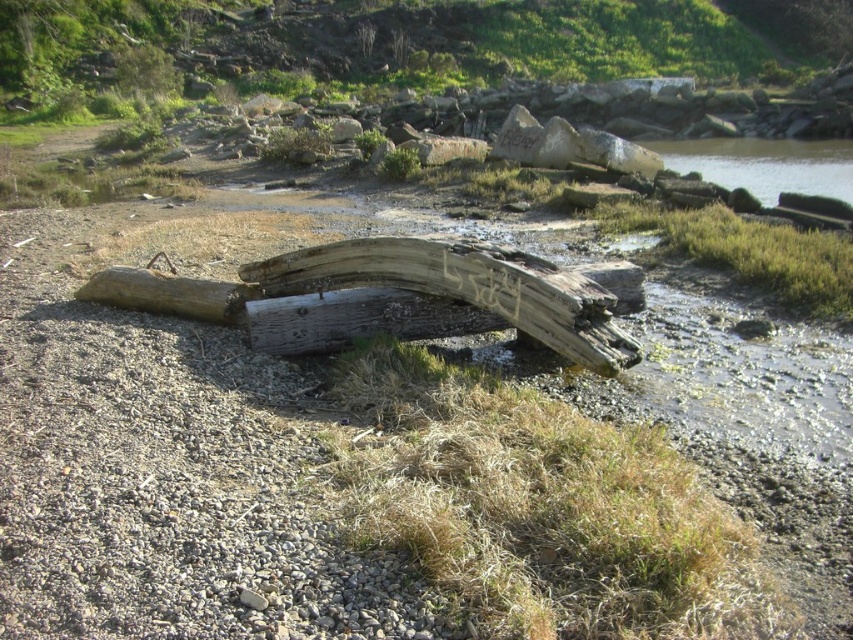
You are standing on the shoreline and want to cross to the other side. You see the weathered wood log at center and the clear water at right. Which one is closer to your current position?

The weathered wood log at center is closer to your current position because it is located below the clear water at right, indicating it is situated nearer to the shoreline where you are standing.

You are standing at the point marked by the coordinates point (467, 289). Looking around, you see the weathered wood log at center. Is the log directly in front of you or to one side?

The weathered wood log at center is represented by point (467, 289), so you are standing exactly at the log. Therefore, the log is directly under your feet, not to one side.

You are standing on the shoreline and want to place a small flag between the weathered wood log at center and the clear water at right. Based on their positions, which object should the flag be closer to?

The flag should be placed closer to the weathered wood log at center because it is in front of the clear water at right, meaning the log is nearer to your current position.